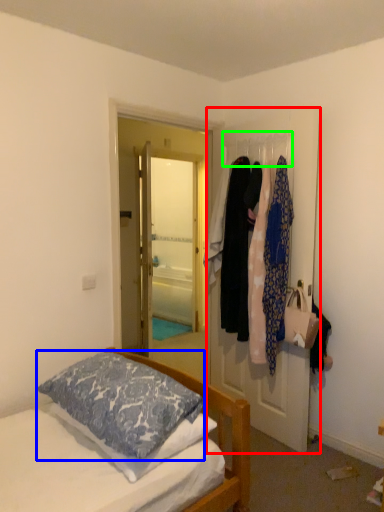
Question: Which object is the farthest from door (highlighted by a red box)? Choose among these: pillow (highlighted by a blue box) or clothesline (highlighted by a green box).

Choices:
 (A) pillow
 (B) clothesline

Answer: (A)